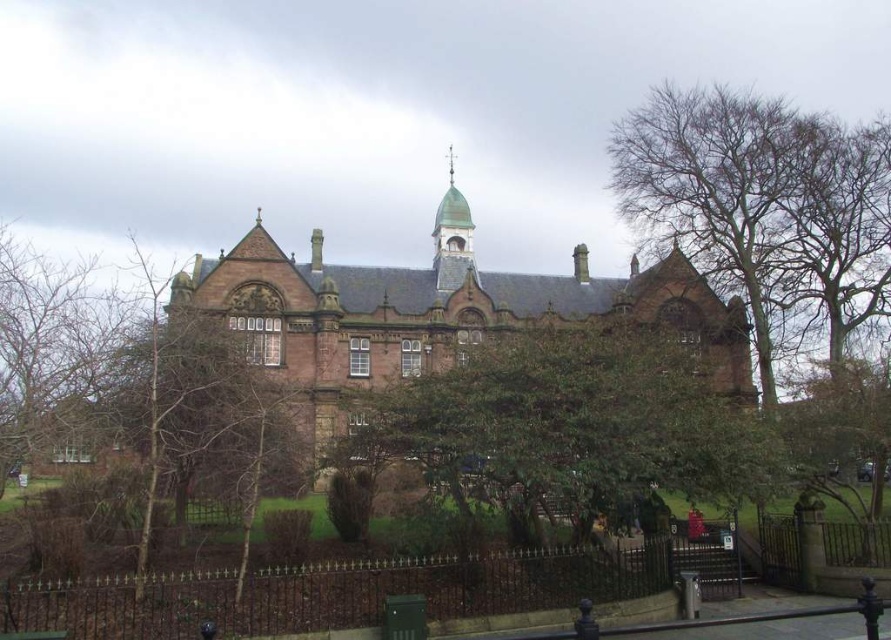
I want to click on brown stone church at center, so click(436, 310).